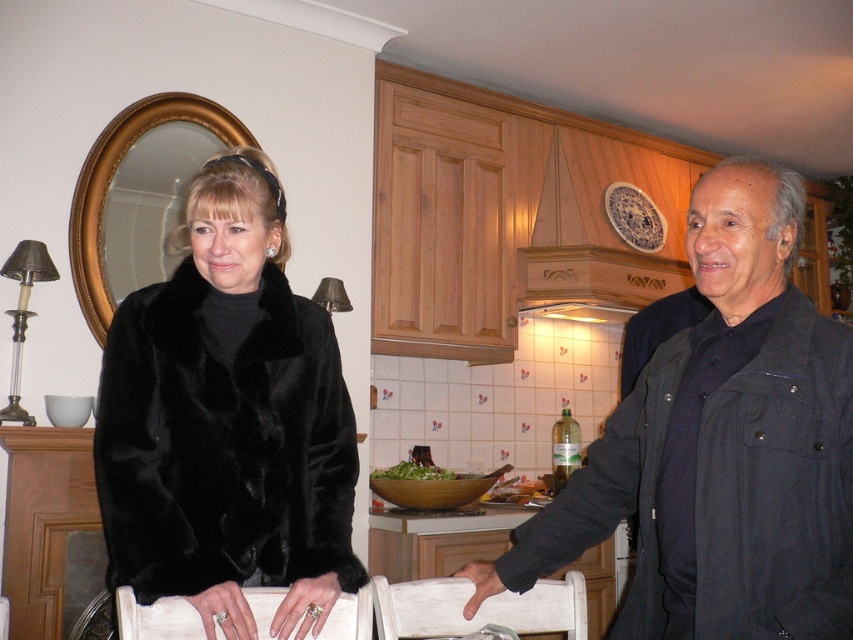
What are the coordinates of the black fur coat at upper left?

The coordinates of the black fur coat at upper left are at point (227, 420).